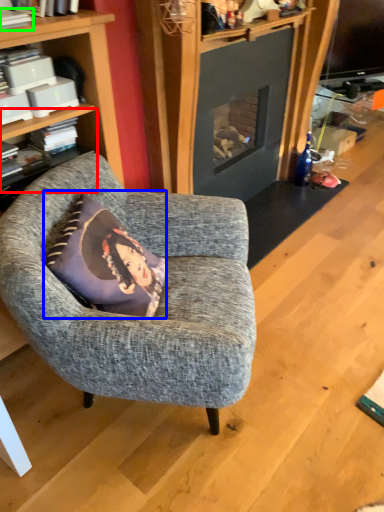
Question: Which is farther away from shelf (highlighted by a red box)? pillow (highlighted by a blue box) or book (highlighted by a green box)?

Choices:
 (A) pillow
 (B) book

Answer: (A)